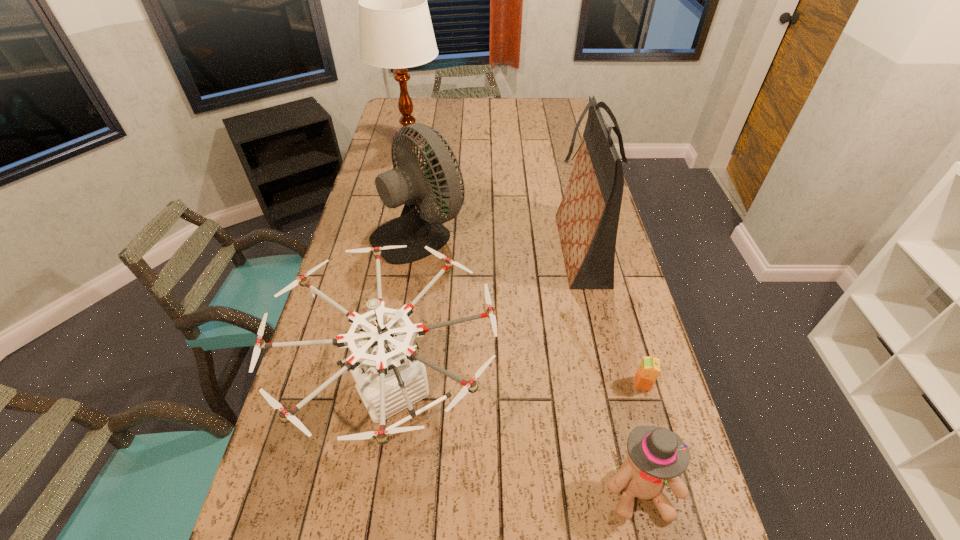
Locate an element on the screen. object that is the fourth closest one to the drone is located at coordinates click(649, 369).

Find the location of a particular element. The height and width of the screenshot is (540, 960). vacant space that satisfies the following two spatial constraints: 1. on the front-facing side of the shopping bag; 2. on the left side of the orange juice is located at coordinates coord(611,383).

Locate an element on the screen. This screenshot has height=540, width=960. vacant space that satisfies the following two spatial constraints: 1. in front of the shortest object to direct airflow; 2. on the left side of the fan is located at coordinates (396, 383).

This screenshot has width=960, height=540. What are the coordinates of `vacant region that satisfies the following two spatial constraints: 1. on the front-facing side of the orange juice; 2. on the left side of the shopping bag` in the screenshot? It's located at (611, 383).

Image resolution: width=960 pixels, height=540 pixels. In order to click on free space that satisfies the following two spatial constraints: 1. on the front-facing side of the shopping bag; 2. on the back side of the orange juice in this screenshot , I will do `click(611, 383)`.